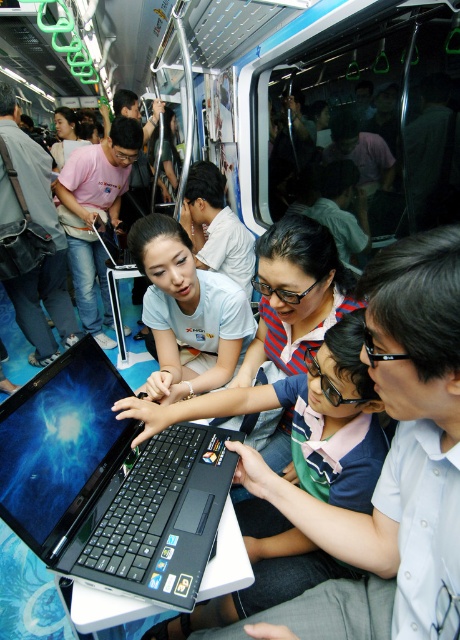
Does matte white shirt at center have a lesser height compared to matte black laptop at left?

Indeed, matte white shirt at center has a lesser height compared to matte black laptop at left.

Is matte white shirt at center positioned before matte black laptop at left?

Yes, it is.

Is point (184, 257) positioned in front of point (32, 289)?

Yes, point (184, 257) is closer to viewer.

You are a GUI agent. You are given a task and a screenshot of the screen. Output one action in this format:
    pyautogui.click(x=<x>, y=<y>)
    Task: Click on the matte white shirt at center
    This screenshot has width=460, height=640.
    Given the screenshot: What is the action you would take?
    pyautogui.click(x=188, y=310)

Between matte white shirt at center and light blue shirt at center, which one has less height?

With less height is matte white shirt at center.

Does point (170, 364) lie in front of point (226, 236)?

Yes, it is in front of point (226, 236).

Between point (176, 385) and point (213, 221), which one is positioned in front?

Point (176, 385) is in front.

The image size is (460, 640). I want to click on matte white shirt at center, so click(x=188, y=310).

Does point (64, 186) lie in front of point (220, 237)?

No, (64, 186) is behind (220, 237).

Can you confirm if matte pink shirt at center is positioned to the right of light blue shirt at center?

Incorrect, matte pink shirt at center is not on the right side of light blue shirt at center.

Does point (92, 205) lie in front of point (197, 260)?

No, (92, 205) is behind (197, 260).

Find the location of `matte pink shirt at center`. matte pink shirt at center is located at coordinates (95, 212).